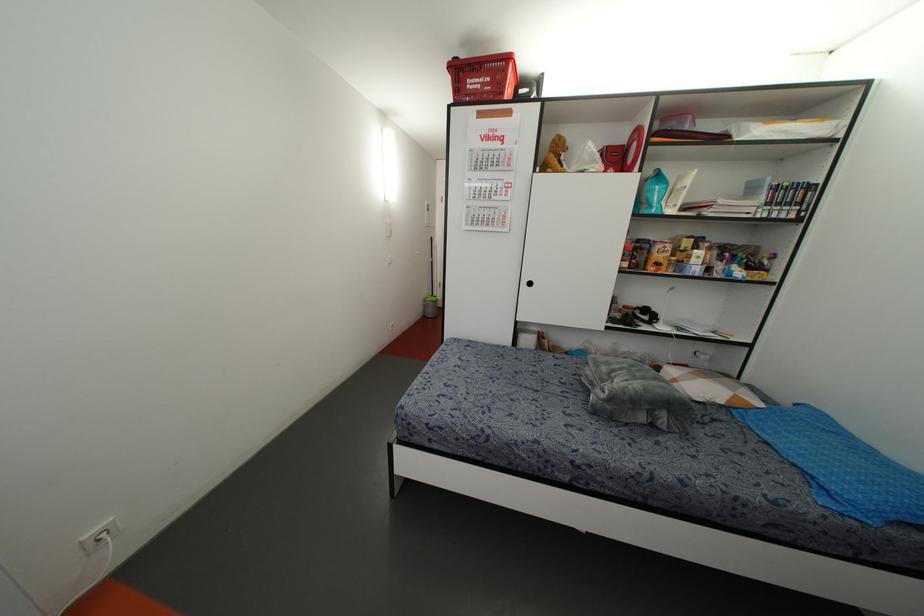
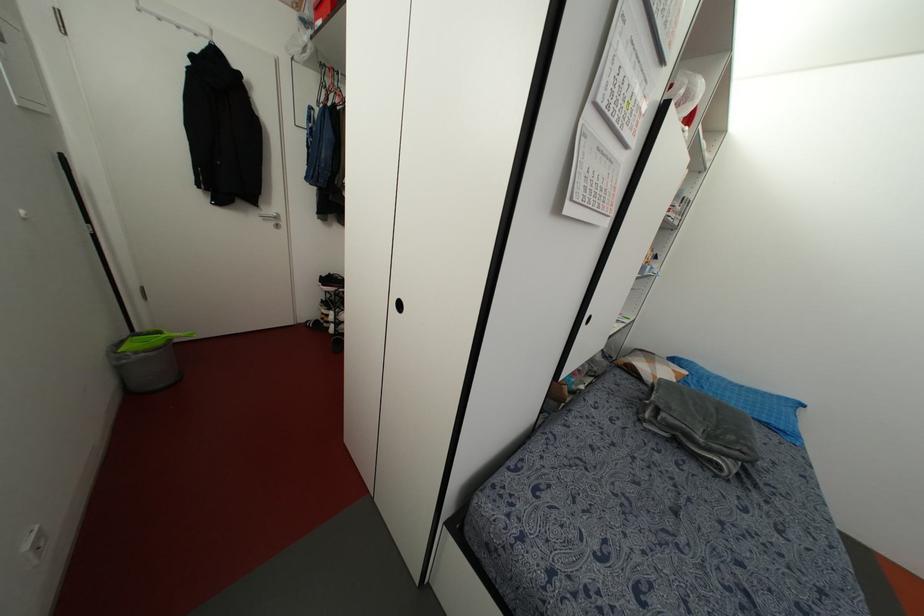
Where in the second image is the point corresponding to point (831, 487) from the first image?

(782, 427)